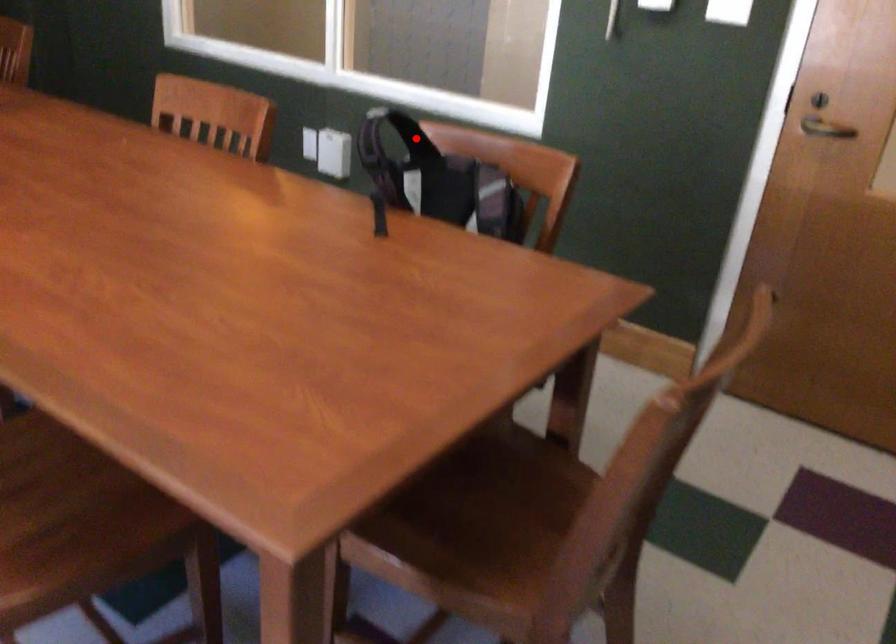
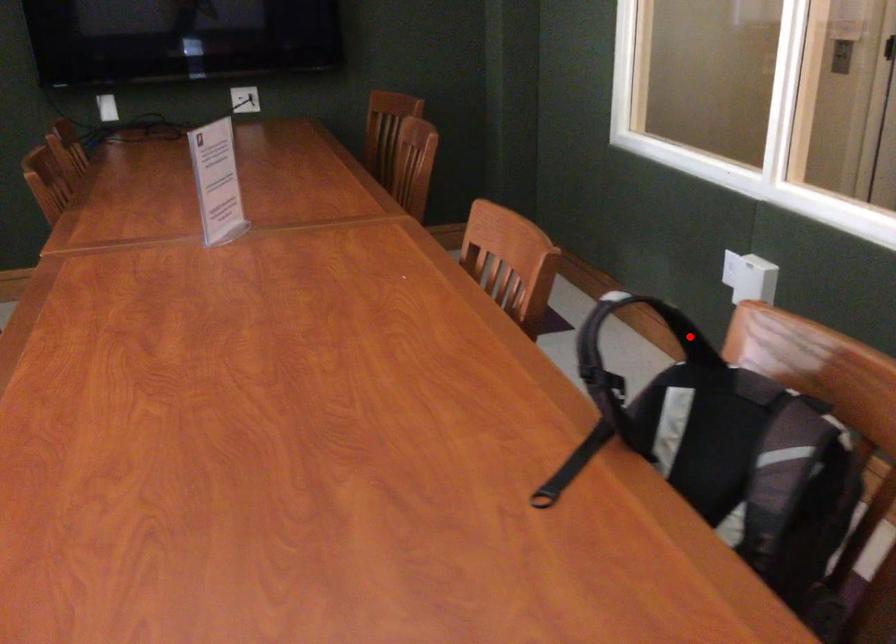
I am providing you with two images of the same scene from different viewpoints. A red point is marked on the first image and another point is marked on the second image. Does the point marked in image1 correspond to the same location as the one in image2?

Yes